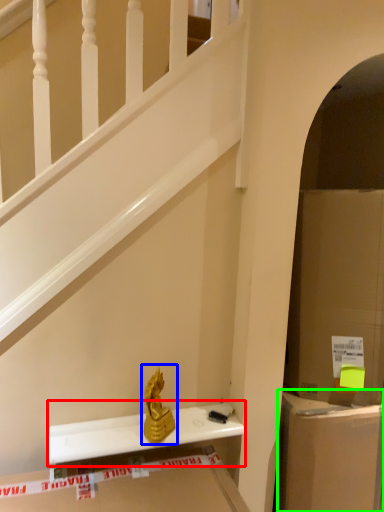
Question: Based on their relative distances, which object is farther from window sill (highlighted by a red box)? Choose from sculpture (highlighted by a blue box) and cabinet (highlighted by a green box).

Choices:
 (A) sculpture
 (B) cabinet

Answer: (B)